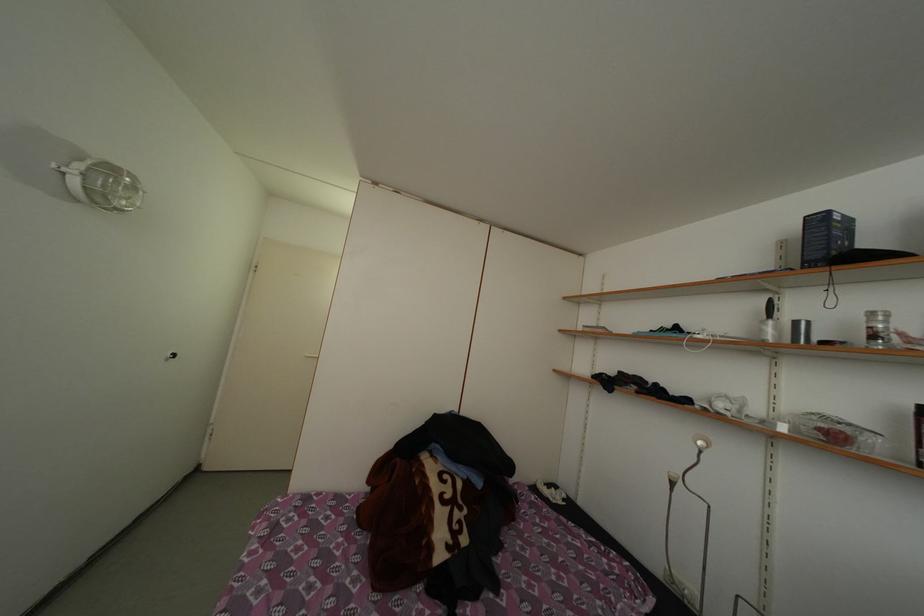
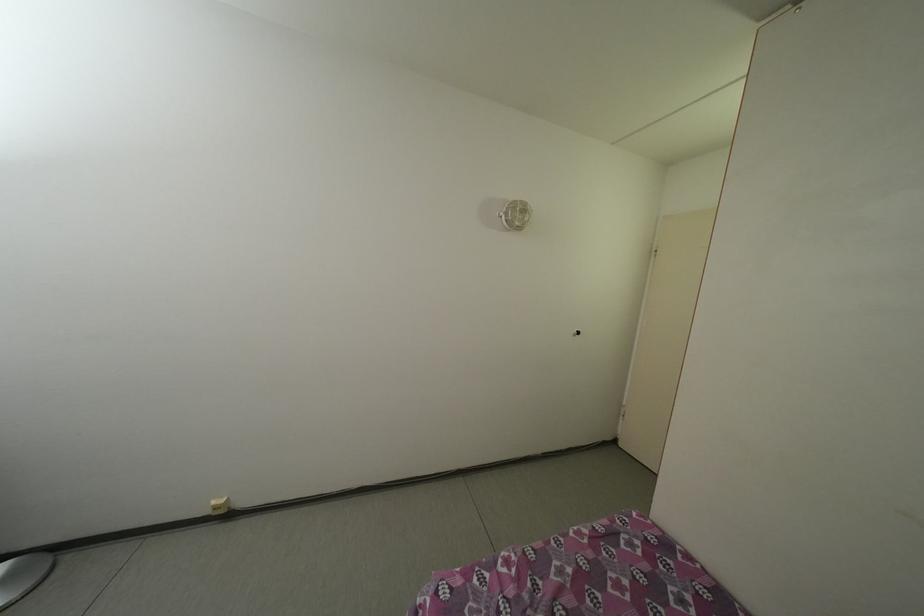
Question: The camera is either moving clockwise (left) or counter-clockwise (right) around the object. The first image is from the beginning of the video and the second image is from the end. Is the camera moving left or right when shooting the video?

Choices:
 (A) Left
 (B) Right

Answer: (B)